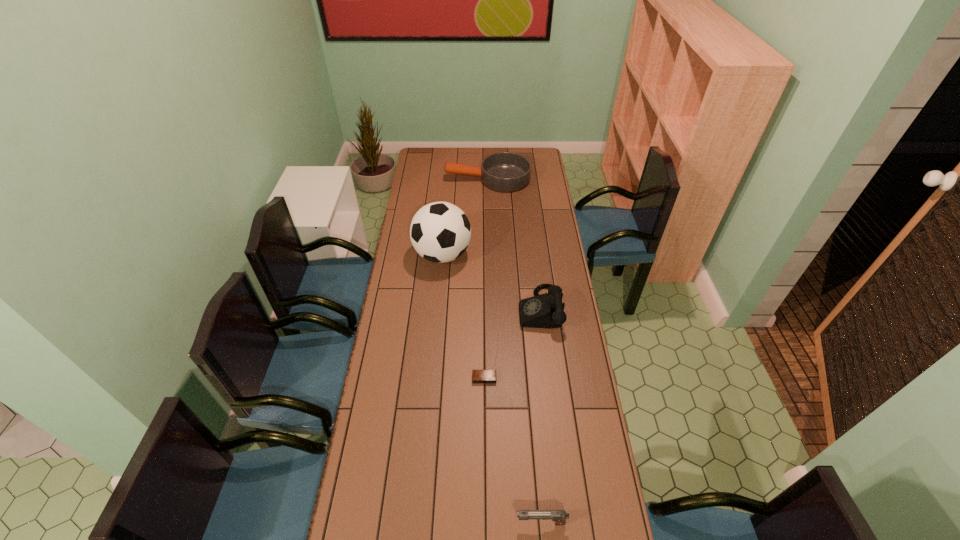
The height and width of the screenshot is (540, 960). Find the location of `free space that satisfies the following two spatial constraints: 1. on the dial of the telephone; 2. on the front face of the second nearest object`. free space that satisfies the following two spatial constraints: 1. on the dial of the telephone; 2. on the front face of the second nearest object is located at coordinates (548, 378).